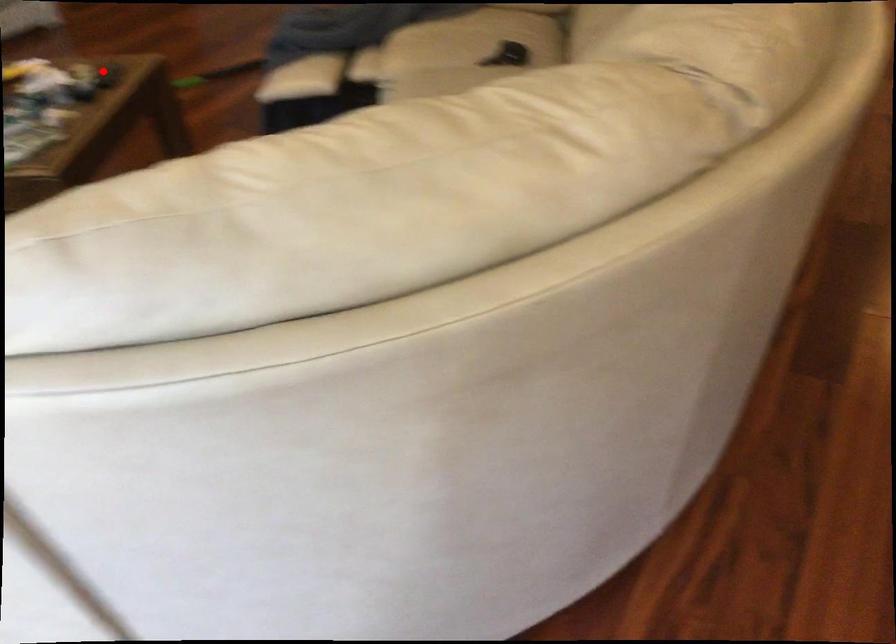
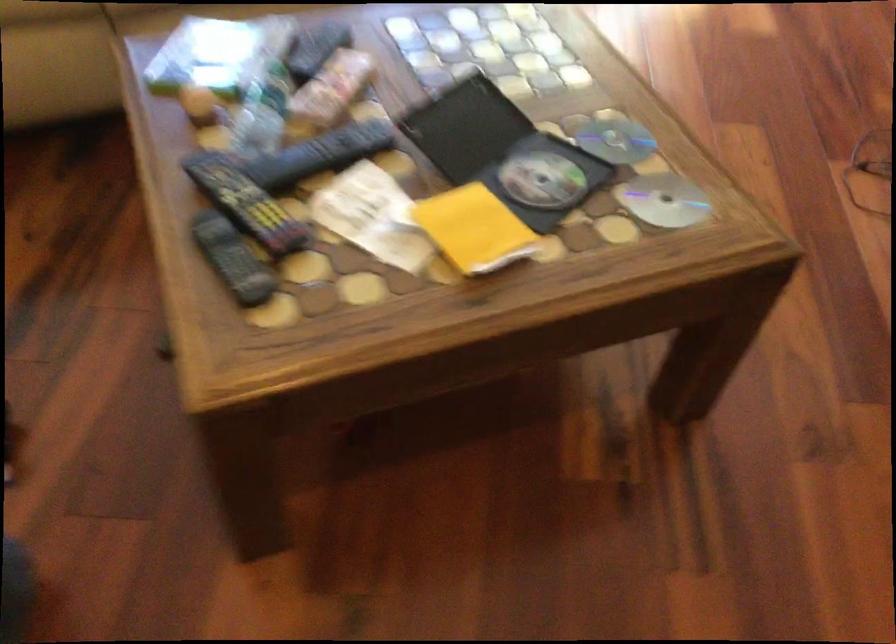
Question: I am providing you with two images of the same scene from different viewpoints. In image1, a red point is highlighted. Considering the same 3D point in image2, which of the following is correct?

Choices:
 (A) It is closer
 (B) It is farther

Answer: (A)